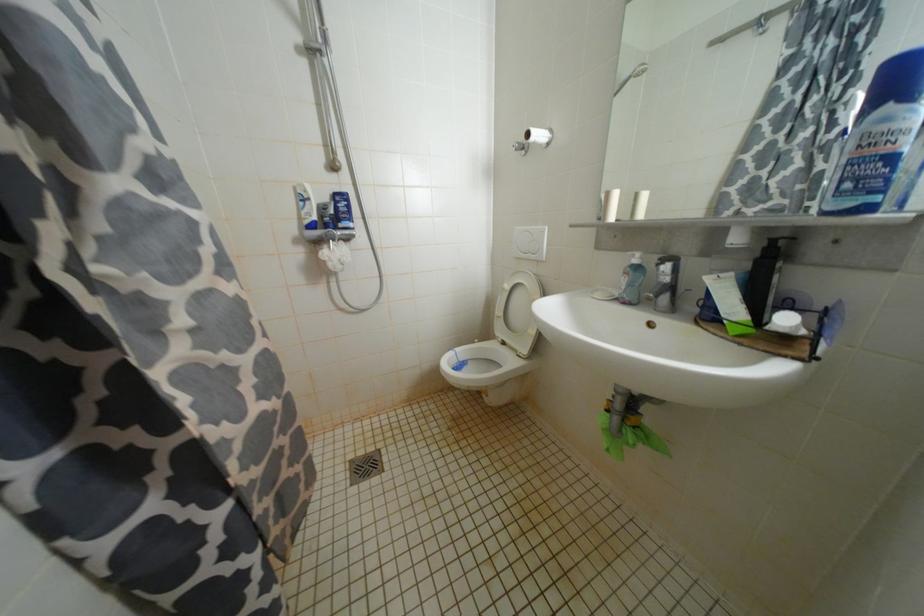
Find where to lift the small white jar. Please return your answer as a coordinate pair (x, y).

(785, 323)